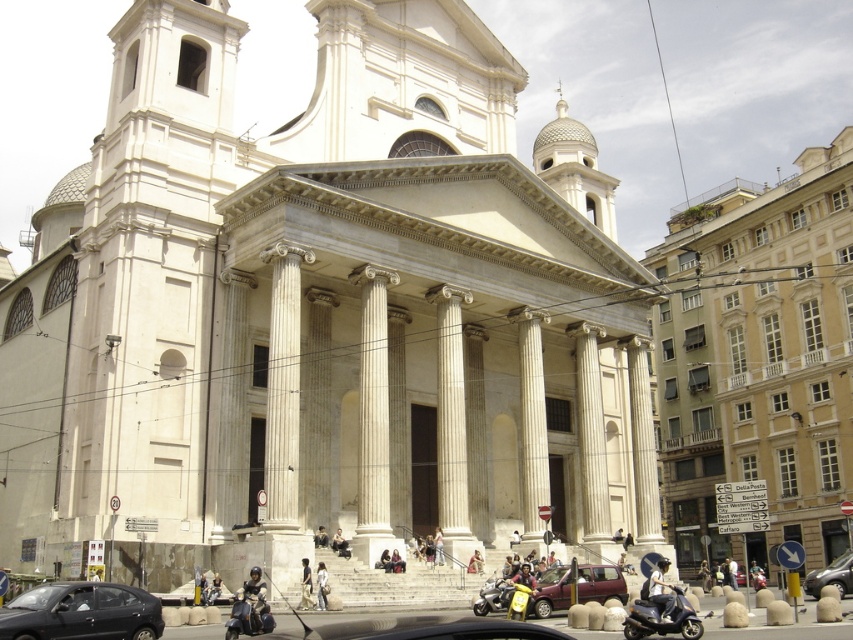
Can you confirm if shiny metallic scooter at lower center is thinner than silver metallic sedan at lower right?

Yes, shiny metallic scooter at lower center is thinner than silver metallic sedan at lower right.

Describe the element at coordinates (248, 612) in the screenshot. This screenshot has height=640, width=853. I see `shiny metallic scooter at lower center` at that location.

Which is behind, point (253, 604) or point (837, 582)?

The point (837, 582) is behind.

I want to click on shiny metallic scooter at lower center, so click(248, 612).

From the picture: Which is below, metallic silver scooter at lower right or dark blue leather jacket at lower center?

metallic silver scooter at lower right is below.

Which is in front, point (653, 596) or point (263, 600)?

Point (653, 596) is more forward.

Find the location of a particular element. The image size is (853, 640). metallic silver scooter at lower right is located at coordinates (660, 609).

Who is positioned more to the left, dark blue leather jacket at lower center or light beige stone column at center?

dark blue leather jacket at lower center is more to the left.

How much distance is there between dark blue leather jacket at lower center and light beige stone column at center?

dark blue leather jacket at lower center and light beige stone column at center are 14.55 meters apart from each other.

This screenshot has height=640, width=853. What do you see at coordinates (254, 600) in the screenshot?
I see `dark blue leather jacket at lower center` at bounding box center [254, 600].

Where is `dark blue leather jacket at lower center`? The height and width of the screenshot is (640, 853). dark blue leather jacket at lower center is located at coordinates pos(254,600).